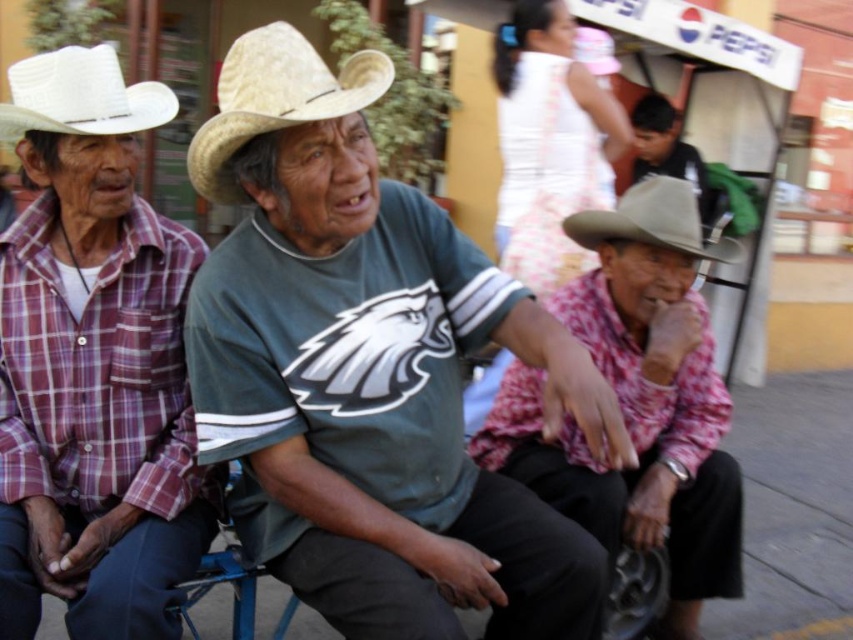
You are a photographer trying to capture a candid shot of the three men in the scene. You notice a specific point marked at coordinates [370,371]. Based on the scene description, where exactly is this point located?

The point at coordinates [370,371] is located on the green jersey at center.

Consider the image. You are a photographer trying to capture a candid shot of the green jersey at center and the white straw cowboy hat at upper left. Based on their positions, can you determine which object is closer to the camera?

The green jersey at center is positioned under the white straw cowboy hat at upper left, meaning the white straw cowboy hat at upper left is closer to the camera since it appears above the jersey.